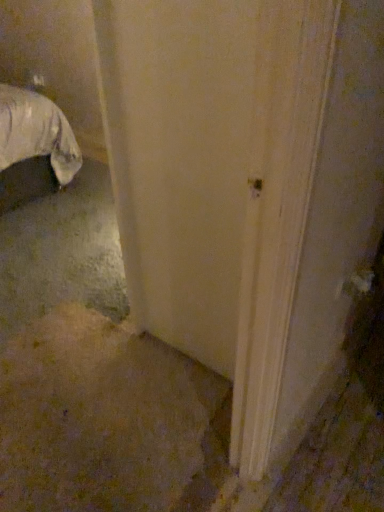
The width and height of the screenshot is (384, 512). I want to click on white matte door at center, so click(x=245, y=185).

In order to face white matte door at center, should I rotate leftwards or rightwards?

To align with it, rotate left about 0.673°.

What do you see at coordinates (245, 185) in the screenshot? I see `white matte door at center` at bounding box center [245, 185].

Locate an element on the screen. This screenshot has height=512, width=384. white matte door at center is located at coordinates (245, 185).